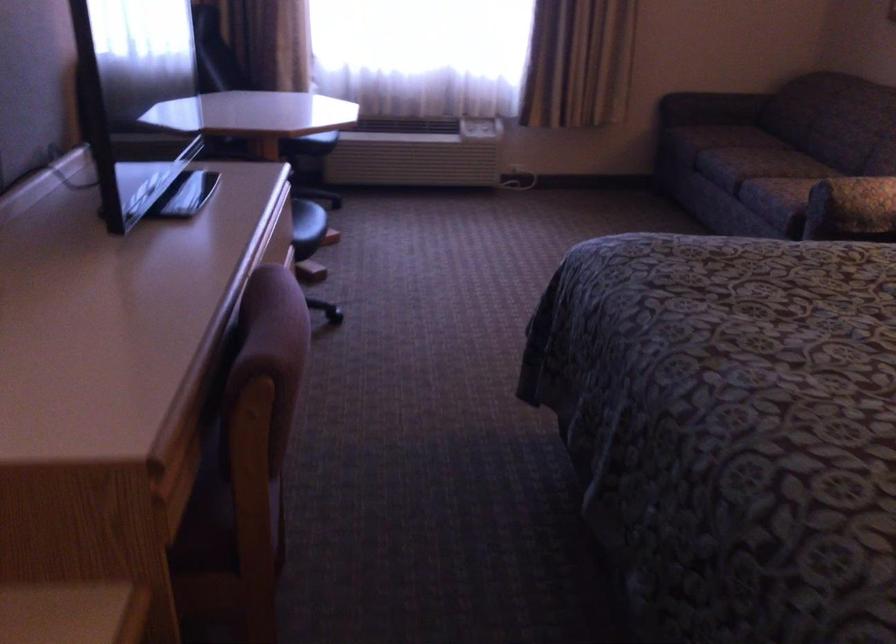
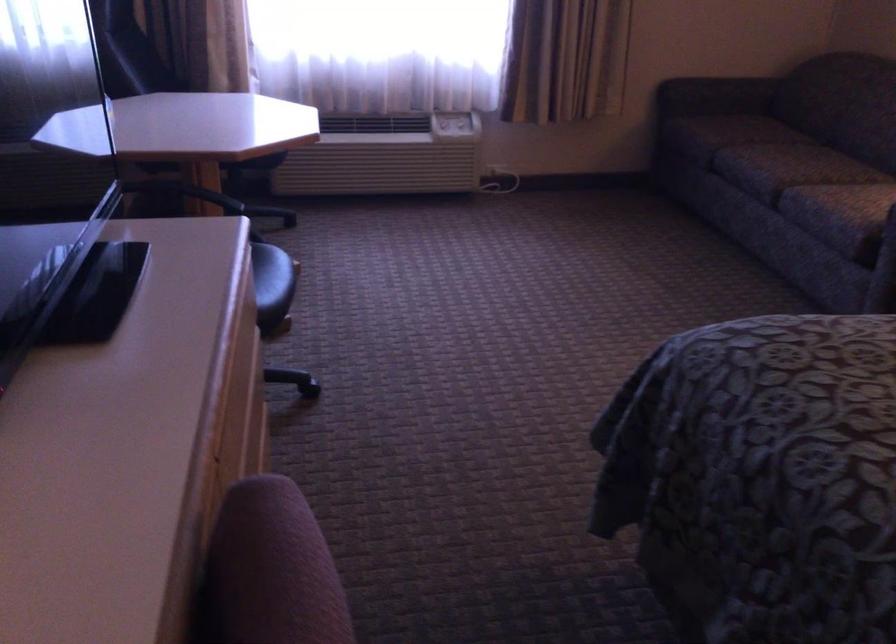
Question: The first image is from the beginning of the video and the second image is from the end. How did the camera likely rotate when shooting the video?

Choices:
 (A) Left
 (B) Right
 (C) Up
 (D) Down

Answer: (B)